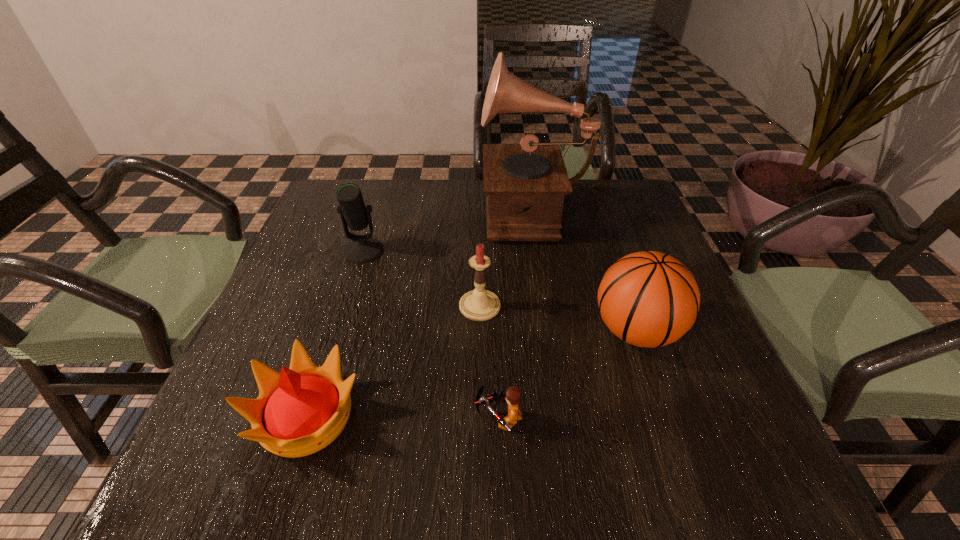
This screenshot has height=540, width=960. Find the location of `record player`. record player is located at coordinates (525, 184).

Identify the location of microphone. (354, 214).

The width and height of the screenshot is (960, 540). Find the location of `basketball`. basketball is located at coordinates (649, 299).

Locate an element on the screen. This screenshot has width=960, height=540. candle is located at coordinates (479, 304).

You are a GUI agent. You are given a task and a screenshot of the screen. Output one action in this format:
    pyautogui.click(x=<x>, y=<y>)
    Task: Click on the second shortest object
    
    Given the screenshot: What is the action you would take?
    pyautogui.click(x=301, y=410)

Locate an element on the screen. The height and width of the screenshot is (540, 960). Lego is located at coordinates (512, 397).

This screenshot has width=960, height=540. I want to click on free location located 0.190m on the horn of the tallest object, so click(x=413, y=210).

Identify the location of free region located 0.090m on the horn of the tallest object. (448, 210).

Find the location of a particular element. Image resolution: width=960 pixels, height=540 pixels. vacant space located on the horn of the tallest object is located at coordinates (456, 210).

At what (x,y) coordinates should I click in order to perform the action: click on free space located 0.300m on the front of the microphone. Please return your answer as a coordinate pair (x, y). The width and height of the screenshot is (960, 540). Looking at the image, I should click on (327, 366).